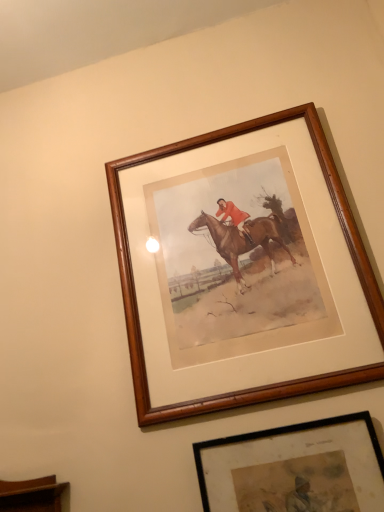
Question: Which direction should I rotate to look at wooden framed print at center, the first picture frame ordered from the bottom, — up or down?

Choices:
 (A) down
 (B) up

Answer: (A)

Question: From the image's perspective, is wooden framed print at center, placed as the second picture frame when sorted from top to bottom, under wooden frame at upper center, marked as the first picture frame in a top-to-bottom arrangement?

Choices:
 (A) yes
 (B) no

Answer: (A)

Question: Does wooden framed print at center, the first picture frame ordered from the bottom, lie behind wooden frame at upper center, marked as the first picture frame in a top-to-bottom arrangement?

Choices:
 (A) yes
 (B) no

Answer: (B)

Question: Does wooden framed print at center, the first picture frame ordered from the bottom, appear on the left side of wooden frame at upper center, marked as the first picture frame in a top-to-bottom arrangement?

Choices:
 (A) no
 (B) yes

Answer: (A)

Question: Is wooden framed print at center, the first picture frame ordered from the bottom, smaller than wooden frame at upper center, which appears as the 2th picture frame when ordered from the bottom?

Choices:
 (A) no
 (B) yes

Answer: (B)

Question: Is wooden framed print at center, placed as the second picture frame when sorted from top to bottom, surrounding wooden frame at upper center, which appears as the 2th picture frame when ordered from the bottom?

Choices:
 (A) no
 (B) yes

Answer: (A)

Question: Is wooden framed print at center, placed as the second picture frame when sorted from top to bottom, next to wooden frame at upper center, which appears as the 2th picture frame when ordered from the bottom?

Choices:
 (A) no
 (B) yes

Answer: (A)

Question: Considering the relative positions of wooden frame at upper center, which appears as the 2th picture frame when ordered from the bottom, and wooden framed print at center, the first picture frame ordered from the bottom, in the image provided, is wooden frame at upper center, which appears as the 2th picture frame when ordered from the bottom, behind wooden framed print at center, the first picture frame ordered from the bottom,?

Choices:
 (A) yes
 (B) no

Answer: (A)

Question: Does wooden frame at upper center, which appears as the 2th picture frame when ordered from the bottom, have a lesser width compared to wooden framed print at center, placed as the second picture frame when sorted from top to bottom?

Choices:
 (A) yes
 (B) no

Answer: (B)

Question: Is wooden frame at upper center, which appears as the 2th picture frame when ordered from the bottom, far away from wooden framed print at center, placed as the second picture frame when sorted from top to bottom?

Choices:
 (A) yes
 (B) no

Answer: (B)

Question: Does wooden frame at upper center, which appears as the 2th picture frame when ordered from the bottom, contain wooden framed print at center, placed as the second picture frame when sorted from top to bottom?

Choices:
 (A) yes
 (B) no

Answer: (B)

Question: Is wooden frame at upper center, marked as the first picture frame in a top-to-bottom arrangement, completely or partially outside of wooden framed print at center, placed as the second picture frame when sorted from top to bottom?

Choices:
 (A) yes
 (B) no

Answer: (A)

Question: From a real-world perspective, is wooden frame at upper center, which appears as the 2th picture frame when ordered from the bottom, located beneath wooden framed print at center, the first picture frame ordered from the bottom?

Choices:
 (A) no
 (B) yes

Answer: (A)

Question: Would you say wooden frame at upper center, marked as the first picture frame in a top-to-bottom arrangement, is to the left or to the right of wooden framed print at center, placed as the second picture frame when sorted from top to bottom, in the picture?

Choices:
 (A) left
 (B) right

Answer: (A)